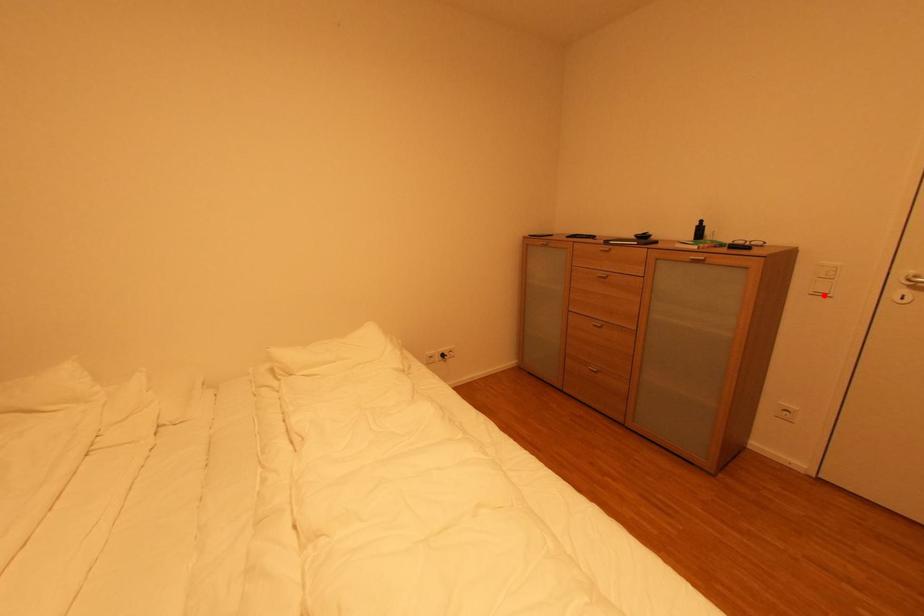
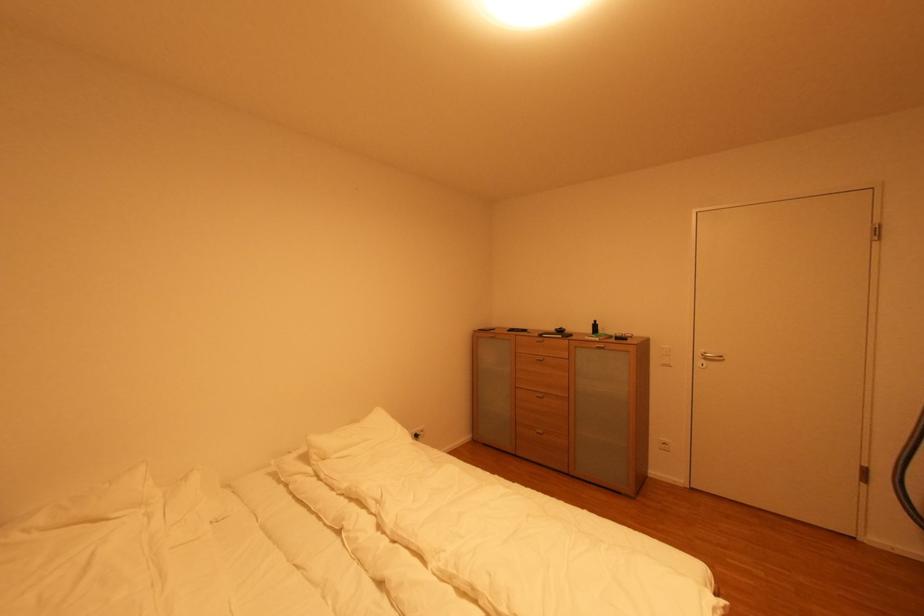
Question: I am providing you with two images of the same scene from different viewpoints. Given a red point in image1, look at the same physical point in image2. Is it:

Choices:
 (A) Closer to the viewpoint
 (B) Farther from the viewpoint

Answer: (B)